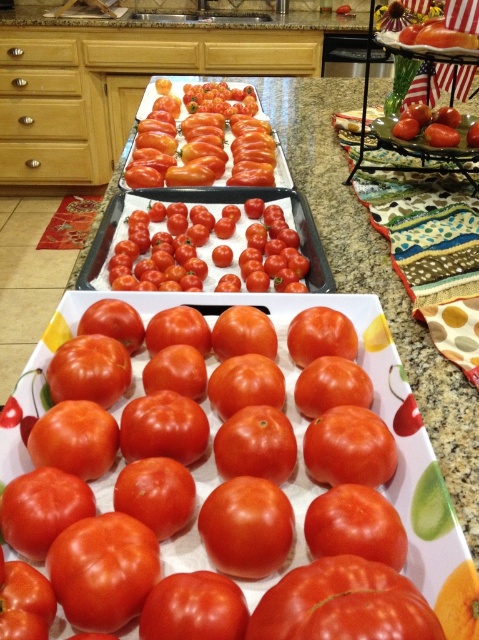
Question: Is shiny red tomato at center further to the viewer compared to shiny red tomatoes at center?

Choices:
 (A) yes
 (B) no

Answer: (B)

Question: Which point appears farthest from the camera in this image?

Choices:
 (A) (295, 288)
 (B) (214, 150)

Answer: (B)

Question: Does shiny red tomato at center appear on the right side of shiny red tomatoes at center?

Choices:
 (A) yes
 (B) no

Answer: (A)

Question: Is shiny red tomato at center to the right of shiny red tomatoes at center from the viewer's perspective?

Choices:
 (A) no
 (B) yes

Answer: (B)